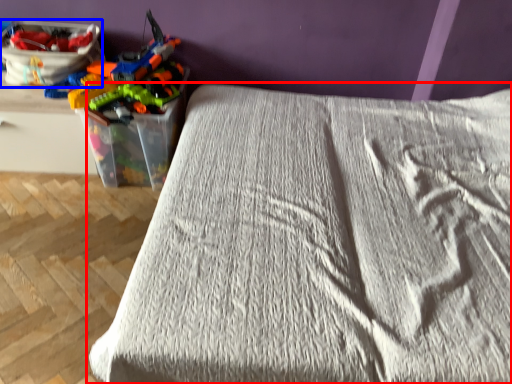
Question: Which of the following is the farthest to the observer, bed (highlighted by a red box) or equipment (highlighted by a blue box)?

Choices:
 (A) bed
 (B) equipment

Answer: (B)